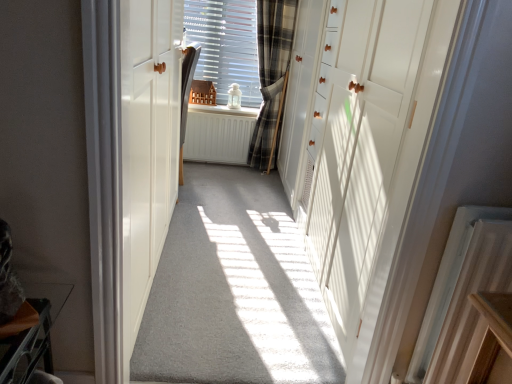
Question: Does white wood door at left, the first door from the left, have a larger size compared to white painted wood at center?

Choices:
 (A) yes
 (B) no

Answer: (A)

Question: Is white wood door at left, the first door from the left, closer to camera compared to white painted wood at center?

Choices:
 (A) no
 (B) yes

Answer: (B)

Question: Is there a large distance between white wood door at left, the first door from the left, and white painted wood at center?

Choices:
 (A) yes
 (B) no

Answer: (A)

Question: Is white wood door at left, the 2th door when ordered from right to left, directly adjacent to white painted wood at center?

Choices:
 (A) no
 (B) yes

Answer: (A)

Question: From the image's perspective, is white wood door at left, the first door from the left, under white painted wood at center?

Choices:
 (A) no
 (B) yes

Answer: (B)

Question: Is point click(163, 21) closer or farther from the camera than point click(206, 109)?

Choices:
 (A) farther
 (B) closer

Answer: (B)

Question: Based on their sizes in the image, would you say white wood door at left, the 2th door when ordered from right to left, is bigger or smaller than white painted wood at center?

Choices:
 (A) big
 (B) small

Answer: (A)

Question: Is white wood door at left, the 2th door when ordered from right to left, inside or outside of white painted wood at center?

Choices:
 (A) inside
 (B) outside

Answer: (B)

Question: Is white wood door at left, the 2th door when ordered from right to left, wider or thinner than white painted wood at center?

Choices:
 (A) wide
 (B) thin

Answer: (A)

Question: Is white matte radiator at center, which is the 1th radiator from back to front, taller or shorter than plaid fabric curtain at center?

Choices:
 (A) short
 (B) tall

Answer: (A)

Question: In the image, is white matte radiator at center, marked as the first radiator in a left-to-right arrangement, on the left side or the right side of plaid fabric curtain at center?

Choices:
 (A) left
 (B) right

Answer: (A)

Question: From a real-world perspective, is white matte radiator at center, which is the 1th radiator in top-to-bottom order, positioned above or below plaid fabric curtain at center?

Choices:
 (A) below
 (B) above

Answer: (A)

Question: Considering the positions of white matte radiator at center, placed as the 2th radiator when sorted from front to back, and plaid fabric curtain at center in the image, is white matte radiator at center, placed as the 2th radiator when sorted from front to back, wider or thinner than plaid fabric curtain at center?

Choices:
 (A) wide
 (B) thin

Answer: (B)

Question: Is white plastic radiator at lower right, the 1th radiator in the bottom-to-top sequence, taller or shorter than plaid fabric curtain at center?

Choices:
 (A) short
 (B) tall

Answer: (A)

Question: From the image's perspective, is white plastic radiator at lower right, the first radiator viewed from the right, located above or below plaid fabric curtain at center?

Choices:
 (A) below
 (B) above

Answer: (A)